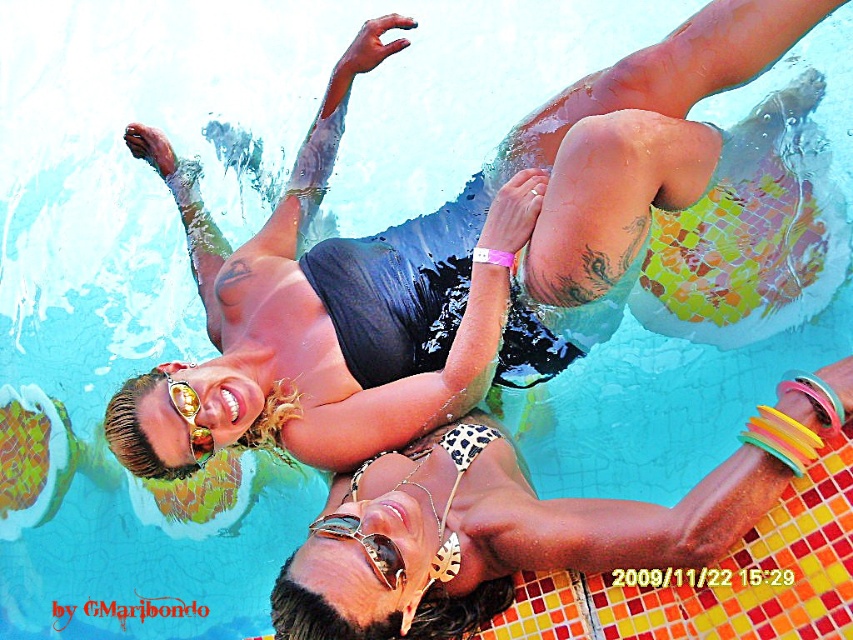
You are designing a storage case for both the gold metallic goggles at center and the gold reflective sunglasses at upper center. Given that the case must accommodate the widest object, which one should you design the case size around?

The gold metallic goggles at center has a larger width than the gold reflective sunglasses at upper center, so the case should be designed to accommodate the gold metallic goggles at center.

You are a lifeguard standing at the edge of the pool. You need to locate the gold metallic goggles at center. Where would you look relative to the pool edge?

The gold metallic goggles at center are located at coordinates 0.853 on the x axis and 0.428 on the y axis relative to the pool edge.

You are a photographer taking a picture of the leopard print bikini top at upper center and the gold metallic goggles at center. Which object is covering part of the other?

The leopard print bikini top at upper center is positioned over the gold metallic goggles at center, so it is covering part of the gold metallic goggles at center.